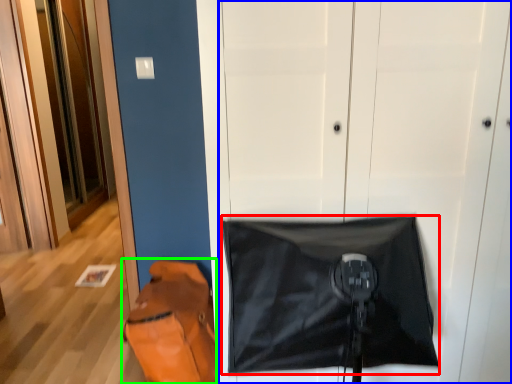
Question: Based on their relative distances, which object is nearer to blanket (highlighted by a red box)? Choose from door (highlighted by a blue box) and messenger bag (highlighted by a green box).

Choices:
 (A) door
 (B) messenger bag

Answer: (A)